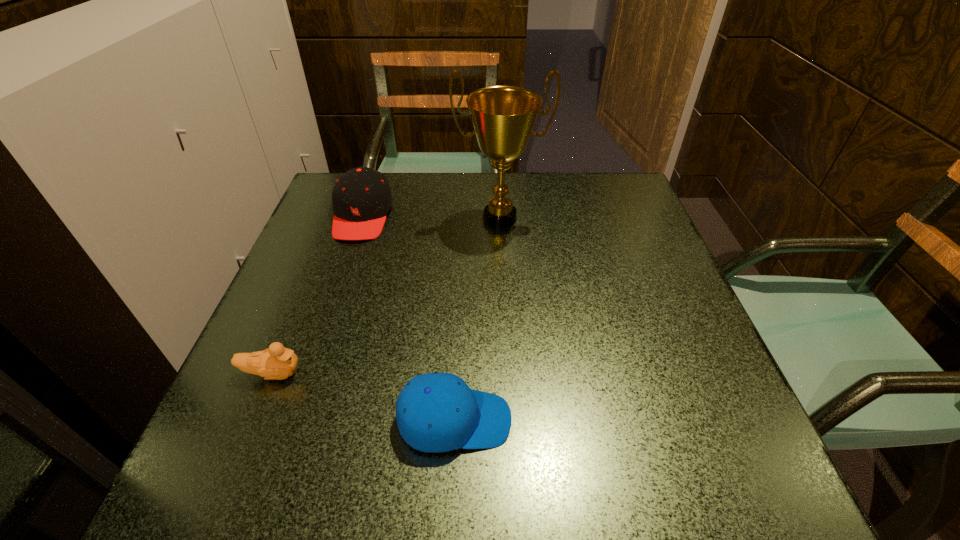
In the image, there is a desktop. Find the location of `free space at the near left corner`. free space at the near left corner is located at coordinates (234, 485).

Find the location of a particular element. This screenshot has height=540, width=960. free point at the far right corner is located at coordinates (610, 194).

Locate an element on the screen. vacant area at the near right corner of the desktop is located at coordinates (740, 483).

Identify the location of free space between the third shortest object and the shorter cap. (408, 318).

Identify the location of empty space that is in between the left cap and the tallest object. Image resolution: width=960 pixels, height=540 pixels. (431, 217).

In order to click on empty location between the award and the nearer cap in this screenshot , I will do `click(477, 319)`.

Locate an element on the screen. The width and height of the screenshot is (960, 540). vacant area that lies between the duckling and the nearest object is located at coordinates (364, 397).

You are a GUI agent. You are given a task and a screenshot of the screen. Output one action in this format:
    pyautogui.click(x=<x>, y=<y>)
    Task: Click on the vacant space in between the award and the third farthest object
    
    Given the screenshot: What is the action you would take?
    pyautogui.click(x=386, y=296)

Locate an element on the screen. The image size is (960, 540). free space between the third farthest object and the right cap is located at coordinates (364, 397).

You are a GUI agent. You are given a task and a screenshot of the screen. Output one action in this format:
    pyautogui.click(x=<x>, y=<y>)
    Task: Click on the free space between the award and the duckling
    This screenshot has width=960, height=540.
    Given the screenshot: What is the action you would take?
    pyautogui.click(x=386, y=296)